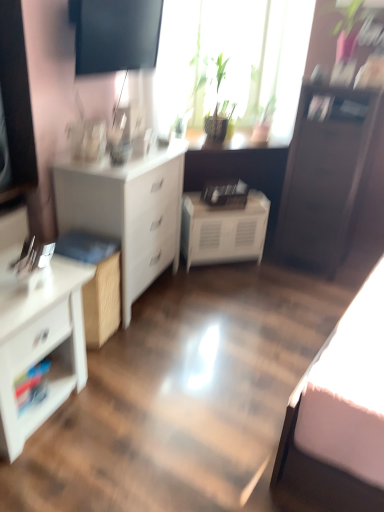
What are the coordinates of `free point to the right of white glossy chest of drawers at left, acting as the first chest of drawers starting from the front` in the screenshot? It's located at (115, 411).